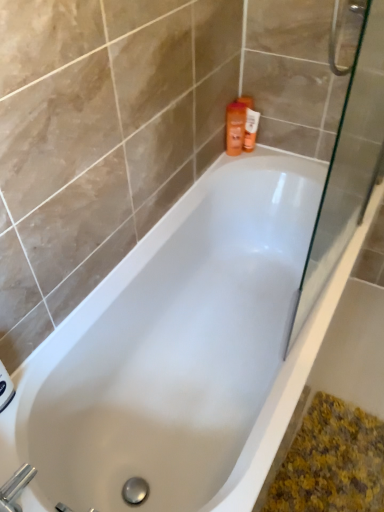
Describe the element at coordinates (182, 351) in the screenshot. Image resolution: width=384 pixels, height=512 pixels. I see `white glossy bathtub at center` at that location.

This screenshot has height=512, width=384. Describe the element at coordinates (235, 127) in the screenshot. I see `orange matte bottle at upper right` at that location.

Identify the location of orange plastic bottle at upper right. (250, 129).

You are a GUI agent. You are given a task and a screenshot of the screen. Output one action in this format:
    pyautogui.click(x=<x>, y=<y>)
    Task: Click on the white glossy bathtub at center
    
    Given the screenshot: What is the action you would take?
    pyautogui.click(x=182, y=351)

In order to click on tap below the orange matte bottle at upper right (from a real-world perspective) in this screenshot , I will do `click(15, 488)`.

From a real-world perspective, is orange matte bottle at upper right physically located above or below silver metallic faucet at lower left?

orange matte bottle at upper right is above silver metallic faucet at lower left.

Is orange matte bottle at upper right facing away from silver metallic faucet at lower left?

No, silver metallic faucet at lower left is not at the back of orange matte bottle at upper right.

Looking at this image, in the image, is orange matte bottle at upper right on the left side or the right side of silver metallic faucet at lower left?

Clearly, orange matte bottle at upper right is on the right of silver metallic faucet at lower left in the image.

Based on the photo, can you confirm if silver metallic faucet at lower left is positioned to the right of orange matte bottle at upper right?

In fact, silver metallic faucet at lower left is to the left of orange matte bottle at upper right.

Which of these two, silver metallic faucet at lower left or orange matte bottle at upper right, is smaller?

silver metallic faucet at lower left.

Does point (1, 502) come behind point (236, 127)?

That is False.

Who is taller, silver metallic faucet at lower left or orange matte bottle at upper right?

orange matte bottle at upper right.

Considering the relative sizes of transparent glass screen door at right and white glossy bathtub at center in the image provided, is transparent glass screen door at right thinner than white glossy bathtub at center?

Yes, transparent glass screen door at right is thinner than white glossy bathtub at center.

From the image's perspective, is transparent glass screen door at right on white glossy bathtub at center?

Yes, from the image's perspective, transparent glass screen door at right is on top of white glossy bathtub at center.

Between transparent glass screen door at right and white glossy bathtub at center, which one appears on the left side from the viewer's perspective?

white glossy bathtub at center is more to the left.

Does point (338, 194) come in front of point (294, 389)?

No, it is behind (294, 389).

In the scene shown: Which of these two, silver metallic faucet at lower left or transparent glass screen door at right, is smaller?

silver metallic faucet at lower left is smaller.

Is point (5, 502) less distant than point (380, 116)?

That is True.

Is silver metallic faucet at lower left in front of or behind transparent glass screen door at right in the image?

silver metallic faucet at lower left is positioned farther from the viewer than transparent glass screen door at right.

Considering the sizes of objects silver metallic faucet at lower left and transparent glass screen door at right in the image provided, who is shorter, silver metallic faucet at lower left or transparent glass screen door at right?

Standing shorter between the two is silver metallic faucet at lower left.

Which of these two, white glossy bathtub at center or orange matte bottle at upper right, stands taller?

With more height is white glossy bathtub at center.

Is white glossy bathtub at center behind orange matte bottle at upper right?

No, it is not.

Can you confirm if white glossy bathtub at center is positioned to the left of orange matte bottle at upper right?

Yes.

Would you say orange matte bottle at upper right is part of white glossy bathtub at center's contents?

No.

Are transparent glass screen door at right and silver metallic faucet at lower left beside each other?

No.

How far apart are transparent glass screen door at right and silver metallic faucet at lower left?

transparent glass screen door at right is 1.30 meters from silver metallic faucet at lower left.

How different are the orientations of transparent glass screen door at right and silver metallic faucet at lower left in degrees?

The angular difference between transparent glass screen door at right and silver metallic faucet at lower left is 89.5 degrees.

In terms of height, does transparent glass screen door at right look taller or shorter compared to silver metallic faucet at lower left?

In the image, transparent glass screen door at right appears to be taller than silver metallic faucet at lower left.

The width and height of the screenshot is (384, 512). What are the coordinates of `bathtub that is below the orange matte bottle at upper right (from the image's perspective)` in the screenshot? It's located at (182, 351).

How far apart are orange matte bottle at upper right and white glossy bathtub at center?

orange matte bottle at upper right and white glossy bathtub at center are 27.44 inches apart from each other.

In the scene shown: Is the depth of orange matte bottle at upper right greater than that of white glossy bathtub at center?

Yes, orange matte bottle at upper right is behind white glossy bathtub at center.

Consider the image. From the image's perspective, is orange matte bottle at upper right beneath white glossy bathtub at center?

No.

Identify the location of cleaning product on the right of silver metallic faucet at lower left. Image resolution: width=384 pixels, height=512 pixels. (235, 127).

At what (x,y) coordinates should I click in order to perform the action: click on cleaning product behind the silver metallic faucet at lower left. Please return your answer as a coordinate pair (x, y). The height and width of the screenshot is (512, 384). Looking at the image, I should click on (235, 127).

Considering their positions, is silver metallic faucet at lower left positioned closer to transparent glass screen door at right than white glossy bathtub at center?

white glossy bathtub at center lies closer to transparent glass screen door at right than the other object.

Looking at the image, which one is located further to orange matte bottle at upper right, silver metallic faucet at lower left or transparent glass screen door at right?

silver metallic faucet at lower left lies further to orange matte bottle at upper right than the other object.

Estimate the real-world distances between objects in this image. Which object is further from white glossy bathtub at center, orange matte bottle at upper right or transparent glass screen door at right?

Based on the image, orange matte bottle at upper right appears to be further to white glossy bathtub at center.

From the image, which object appears to be nearer to silver metallic faucet at lower left, orange matte bottle at upper right or orange plastic bottle at upper right?

The object closer to silver metallic faucet at lower left is orange matte bottle at upper right.

Estimate the real-world distances between objects in this image. Which object is further from orange matte bottle at upper right, orange plastic bottle at upper right or white glossy bathtub at center?

white glossy bathtub at center.

Estimate the real-world distances between objects in this image. Which object is further from silver metallic faucet at lower left, orange plastic bottle at upper right or orange matte bottle at upper right?

A: orange plastic bottle at upper right.

Looking at the image, which one is located closer to orange matte bottle at upper right, orange plastic bottle at upper right or transparent glass screen door at right?

orange plastic bottle at upper right.

Based on their spatial positions, is orange matte bottle at upper right or silver metallic faucet at lower left closer to orange plastic bottle at upper right?

orange matte bottle at upper right is closer to orange plastic bottle at upper right.

The image size is (384, 512). Identify the location of bathtub positioned between transparent glass screen door at right and orange matte bottle at upper right from near to far. (182, 351).

Where is `cleaning product located between white glossy bathtub at center and orange plastic bottle at upper right in the depth direction`? The image size is (384, 512). cleaning product located between white glossy bathtub at center and orange plastic bottle at upper right in the depth direction is located at coordinates (235, 127).

The image size is (384, 512). I want to click on cleaning product between transparent glass screen door at right and orange plastic bottle at upper right from front to back, so click(x=235, y=127).

Identify the location of tap between white glossy bathtub at center and orange plastic bottle at upper right in the front-back direction. (15, 488).